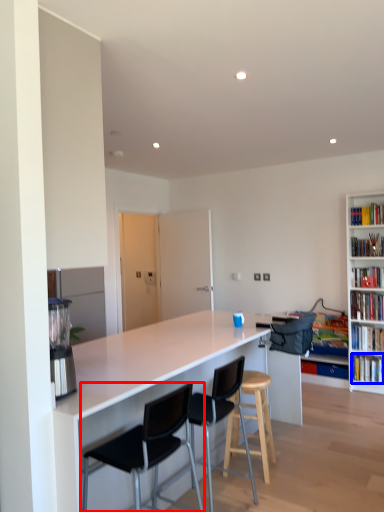
Question: Which of the following is the closest to the observer, chair (highlighted by a red box) or book (highlighted by a blue box)?

Choices:
 (A) chair
 (B) book

Answer: (A)